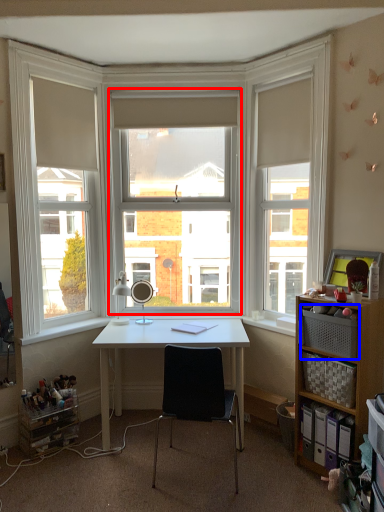
Question: Which point is further to the camera, window (highlighted by a red box) or drawer (highlighted by a blue box)?

Choices:
 (A) window
 (B) drawer

Answer: (A)